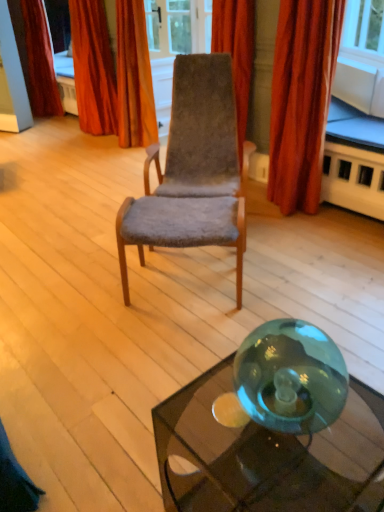
Question: Could you tell me if velvet-like orange curtain at upper center, marked as the second curtain in a right-to-left arrangement, is facing velvet brown chair at center?

Choices:
 (A) yes
 (B) no

Answer: (B)

Question: Is velvet brown chair at center a part of velvet-like orange curtain at upper center, marked as the second curtain in a right-to-left arrangement?

Choices:
 (A) yes
 (B) no

Answer: (B)

Question: Does velvet-like orange curtain at upper center, marked as the second curtain in a right-to-left arrangement, have a smaller size compared to velvet brown chair at center?

Choices:
 (A) no
 (B) yes

Answer: (B)

Question: Is velvet-like orange curtain at upper center, acting as the 3th curtain starting from the left, looking in the opposite direction of velvet brown chair at center?

Choices:
 (A) yes
 (B) no

Answer: (B)

Question: From a real-world perspective, is velvet-like orange curtain at upper center, acting as the 3th curtain starting from the left, positioned under velvet brown chair at center based on gravity?

Choices:
 (A) no
 (B) yes

Answer: (A)

Question: Are velvet-like orange curtain at upper center, marked as the second curtain in a right-to-left arrangement, and velvet brown chair at center making contact?

Choices:
 (A) yes
 (B) no

Answer: (B)

Question: Is transparent glass table at lower right, the second table ordered from the bottom, not inside velvet-like red curtain at upper left, positioned as the third curtain in right-to-left order?

Choices:
 (A) no
 (B) yes

Answer: (B)

Question: From a real-world perspective, is transparent glass table at lower right, the 2th table viewed from the left, on top of velvet-like red curtain at upper left, positioned as the third curtain in right-to-left order?

Choices:
 (A) no
 (B) yes

Answer: (A)

Question: Could velvet-like red curtain at upper left, positioned as the third curtain in right-to-left order, be considered to be inside transparent glass table at lower right, the second table viewed from the front?

Choices:
 (A) yes
 (B) no

Answer: (B)

Question: Does transparent glass table at lower right, which is counted as the first table, starting from the right, have a smaller size compared to velvet-like red curtain at upper left, positioned as the third curtain in right-to-left order?

Choices:
 (A) no
 (B) yes

Answer: (B)

Question: Is transparent glass table at lower right, which is counted as the first table, starting from the right, next to velvet-like red curtain at upper left, which appears as the 2th curtain when viewed from the left, and touching it?

Choices:
 (A) no
 (B) yes

Answer: (A)

Question: From the image's perspective, is transparent glass table at lower right, the second table viewed from the front, on velvet-like red curtain at upper left, positioned as the third curtain in right-to-left order?

Choices:
 (A) yes
 (B) no

Answer: (B)

Question: Would you say velvet-like orange curtain at upper center, acting as the 3th curtain starting from the left, contains velvet-like red curtain at right, the 4th curtain viewed from the left?

Choices:
 (A) no
 (B) yes

Answer: (A)